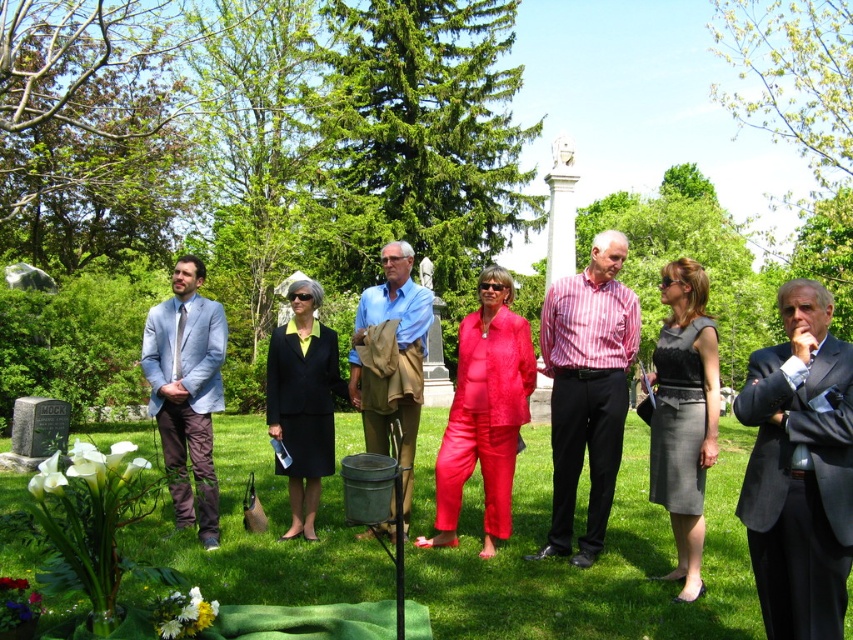
Question: Estimate the real-world distances between objects in this image. Which object is farther from the black suit at center?

Choices:
 (A) silky red jumpsuit at center
 (B) striped cotton shirt at center
 (C) light blue cotton shirt at center
 (D) light blue textured suit at left

Answer: (B)

Question: Can you confirm if gray satin dress at center is positioned to the right of light blue cotton shirt at center?

Choices:
 (A) yes
 (B) no

Answer: (A)

Question: Can you confirm if gray satin dress at center is wider than black suit at center?

Choices:
 (A) yes
 (B) no

Answer: (B)

Question: Is silky red jumpsuit at center to the right of light blue textured suit at left from the viewer's perspective?

Choices:
 (A) yes
 (B) no

Answer: (A)

Question: Which point appears farthest from the camera in this image?

Choices:
 (A) (836, 387)
 (B) (283, 385)
 (C) (619, 426)

Answer: (B)

Question: Which of the following is the farthest from the observer?

Choices:
 (A) (810, 520)
 (B) (466, 349)
 (C) (698, 432)

Answer: (B)